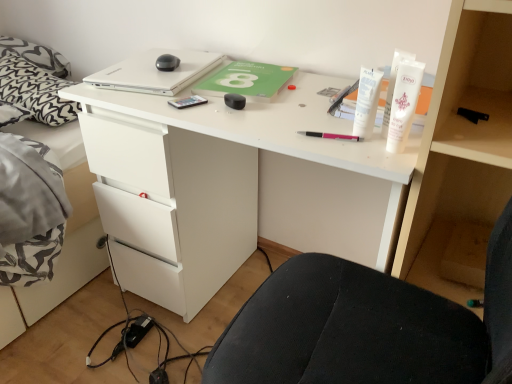
The width and height of the screenshot is (512, 384). Find the location of `free spot above white matte desk at center (from a real-world perspective)`. free spot above white matte desk at center (from a real-world perspective) is located at coordinates (210, 81).